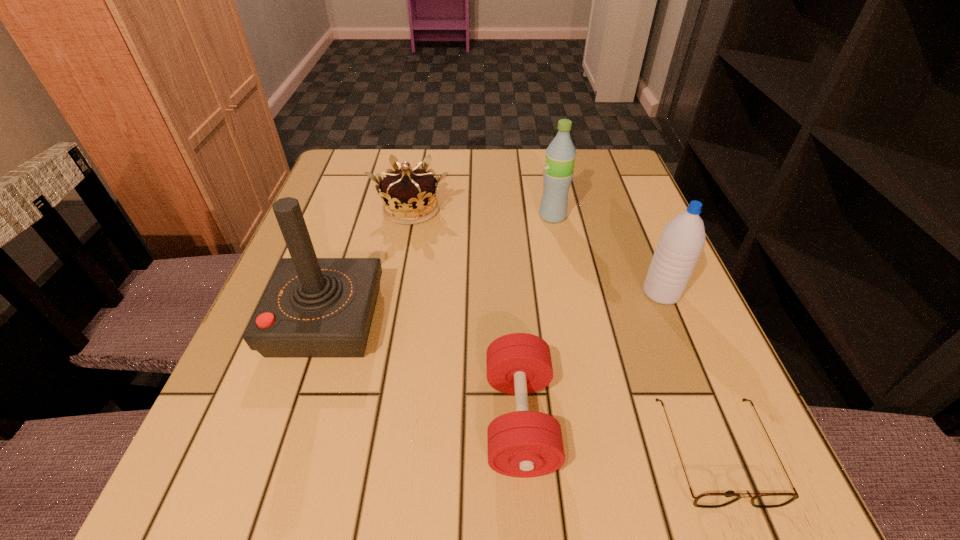
You are a GUI agent. You are given a task and a screenshot of the screen. Output one action in this format:
    pyautogui.click(x=<x>, y=<y>)
    Task: Click on the object that is positioned at the far left corner
    
    Given the screenshot: What is the action you would take?
    pyautogui.click(x=409, y=196)

I want to click on object located at the near right corner, so click(707, 500).

Locate an element on the screen. The width and height of the screenshot is (960, 540). vacant space at the far edge of the desktop is located at coordinates [x=477, y=197].

Where is `blank space at the near edge of the desktop`? Image resolution: width=960 pixels, height=540 pixels. blank space at the near edge of the desktop is located at coordinates (436, 472).

Where is `free space at the right edge of the desktop`? The height and width of the screenshot is (540, 960). free space at the right edge of the desktop is located at coordinates (672, 358).

In the image, there is a desktop. Find the location of `vacant area at the far left corner`. vacant area at the far left corner is located at coordinates (341, 150).

This screenshot has width=960, height=540. In the image, there is a desktop. In order to click on free space at the near left corner in this screenshot , I will do `click(276, 487)`.

Locate an element on the screen. This screenshot has height=540, width=960. free space at the far right corner is located at coordinates (589, 169).

The image size is (960, 540). Identify the location of blank region between the third object from left to right and the nearer water bottle. (590, 356).

At what (x,y) coordinates should I click in order to perform the action: click on free space between the third object from left to right and the joystick. Please return your answer as a coordinate pair (x, y). Looking at the image, I should click on (423, 370).